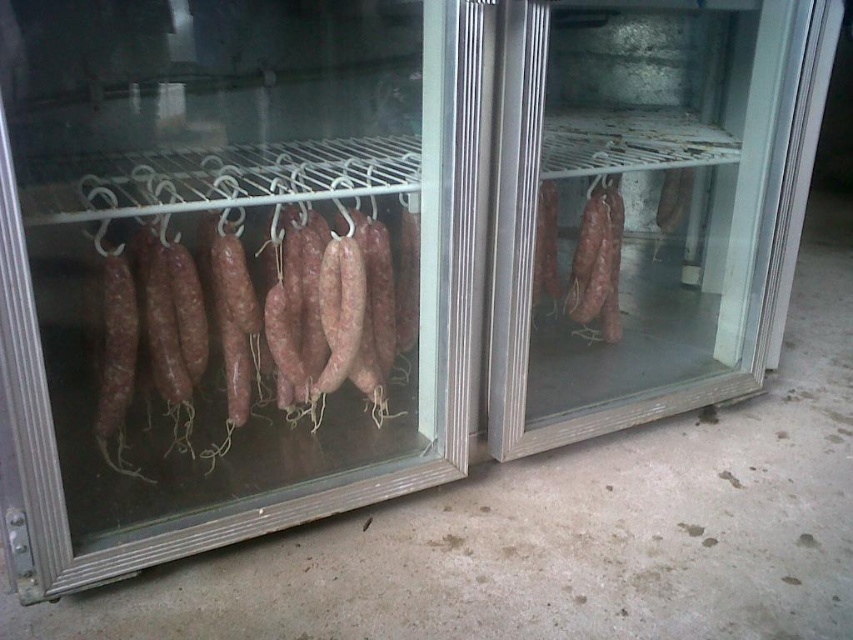
Question: Is transparent glass door at left bigger than brown matte sausages at left?

Choices:
 (A) yes
 (B) no

Answer: (A)

Question: Can you confirm if transparent glass door at left is thinner than transparent glass door at center?

Choices:
 (A) yes
 (B) no

Answer: (B)

Question: Is transparent glass door at left below transparent glass door at center?

Choices:
 (A) no
 (B) yes

Answer: (B)

Question: Which object is closer to the camera taking this photo?

Choices:
 (A) brown matte sausages at left
 (B) transparent glass door at left
 (C) transparent glass door at center

Answer: (B)

Question: Based on their relative distances, which object is farther from the transparent glass door at center?

Choices:
 (A) brown matte sausages at left
 (B) transparent glass door at left

Answer: (A)

Question: Among these objects, which one is farthest from the camera?

Choices:
 (A) brown matte sausages at left
 (B) transparent glass door at left
 (C) transparent glass door at center

Answer: (C)